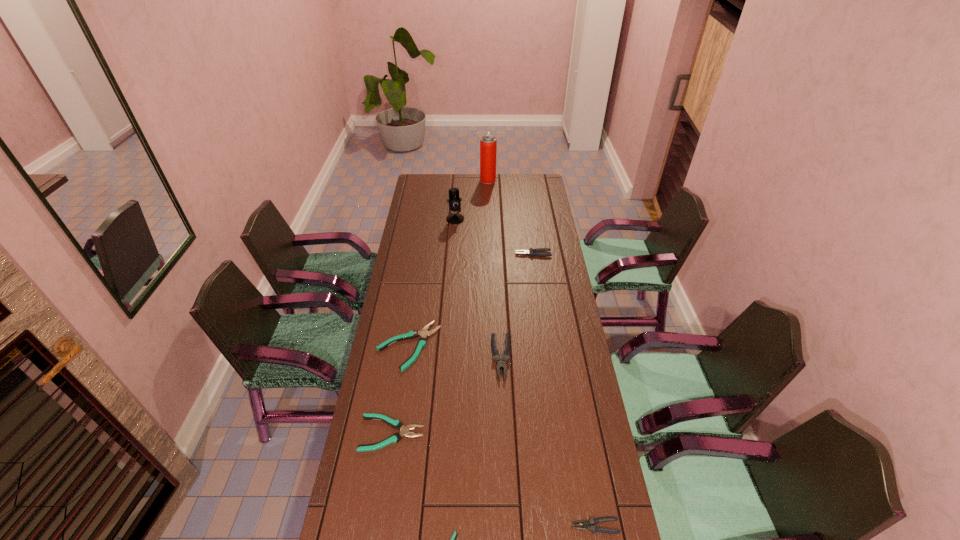
This screenshot has width=960, height=540. Identify the location of vacant point located 0.230m at the gripping part of the nearest gray pliers. (486, 526).

The height and width of the screenshot is (540, 960). In order to click on free space located at the gripping part of the nearest gray pliers in this screenshot , I will do click(475, 526).

Identify the location of blank space located on the right of the fifth tallest pliers. This screenshot has height=540, width=960. (471, 433).

Where is `object at the far edge`? The height and width of the screenshot is (540, 960). object at the far edge is located at coordinates (488, 143).

At what (x,y) coordinates should I click in order to perform the action: click on free space at the far edge of the desktop. Please return your answer as a coordinate pair (x, y). The height and width of the screenshot is (540, 960). Looking at the image, I should click on (444, 187).

The image size is (960, 540). In order to click on vacant space at the left edge of the desktop in this screenshot , I will do `click(403, 310)`.

In order to click on vacant space at the right edge in this screenshot , I will do `click(547, 365)`.

Identify the location of vacant point located between the smallest gray pliers and the black microphone. (525, 373).

The height and width of the screenshot is (540, 960). I want to click on vacant space in between the tallest object and the sixth nearest object, so tap(511, 217).

Locate an element on the screen. unoccupied area between the second biggest teal pliers and the second biggest gray pliers is located at coordinates point(463,343).